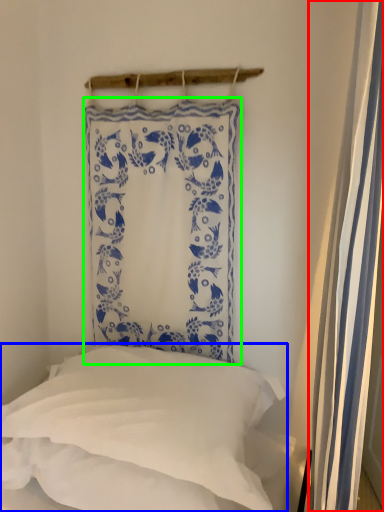
Question: Considering the real-world distances, which object is farthest from shower curtain (highlighted by a red box)? pillow (highlighted by a blue box) or curtain (highlighted by a green box)?

Choices:
 (A) pillow
 (B) curtain

Answer: (B)